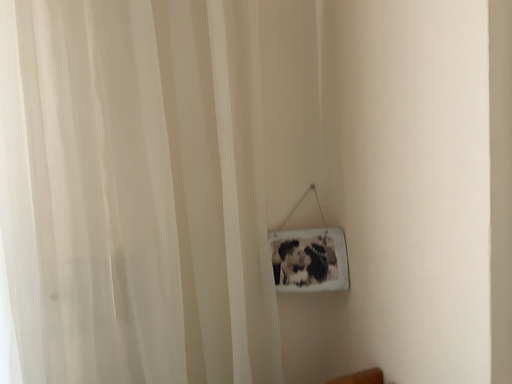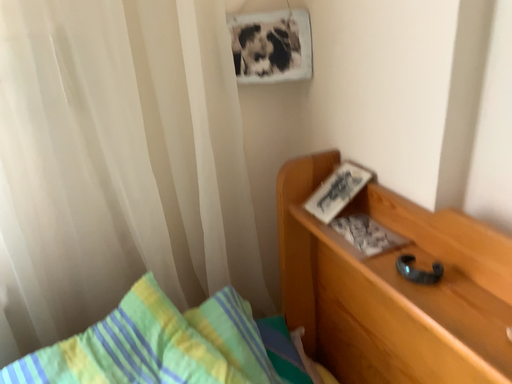
Question: Which way did the camera rotate in the video?

Choices:
 (A) rotated downward
 (B) rotated upward

Answer: (A)